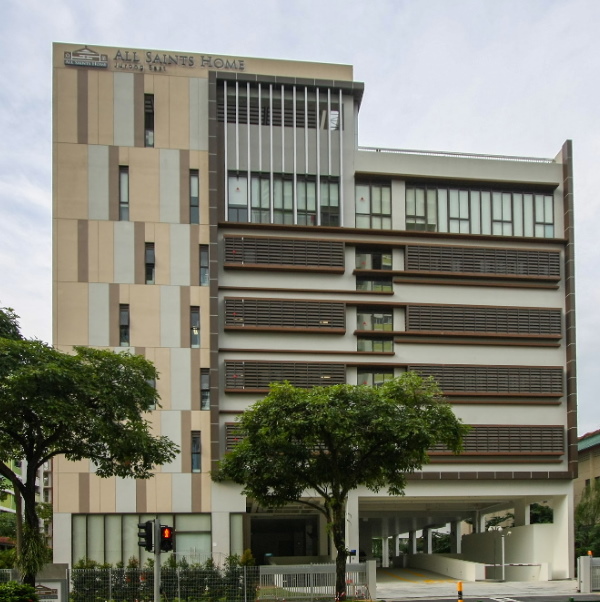
You are a GUI agent. You are given a task and a screenshot of the screen. Output one action in this format:
    pyautogui.click(x=<x>, y=<y>)
    Task: Click on the pillars
    This screenshot has width=600, height=602.
    Given the screenshot: What is the action you would take?
    pyautogui.click(x=456, y=540), pyautogui.click(x=429, y=542), pyautogui.click(x=415, y=545)